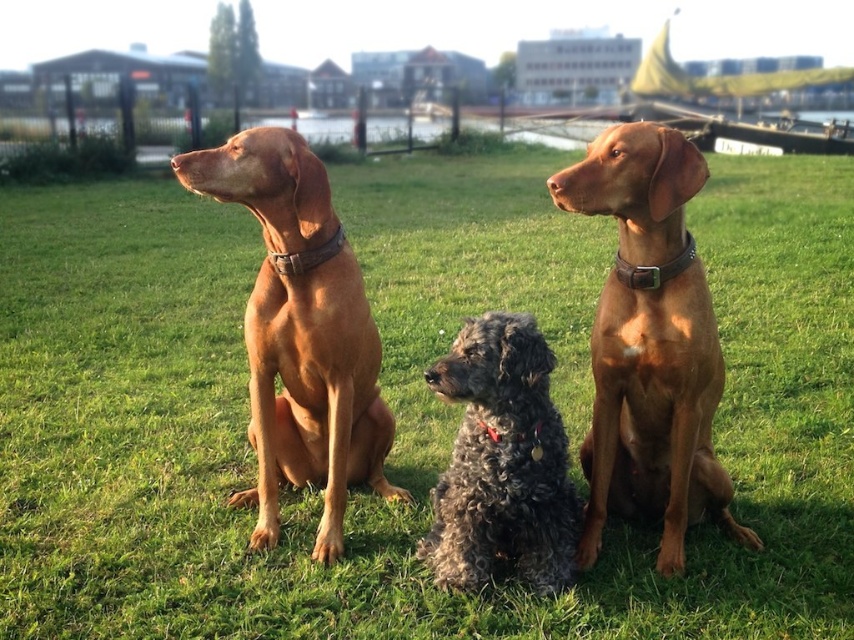
You are a photographer trying to capture a group photo of the matte brown dog at center and the curly gray fur at center. Since you want to ensure both dogs are in focus, you need to know their height difference. Which dog is taller?

The matte brown dog at center is much taller than the curly gray fur at center.